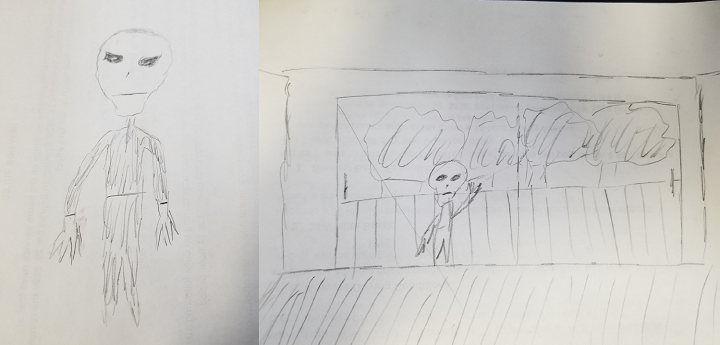
The width and height of the screenshot is (720, 345). What are the coordinates of `ceiling` in the screenshot? It's located at (454, 31).